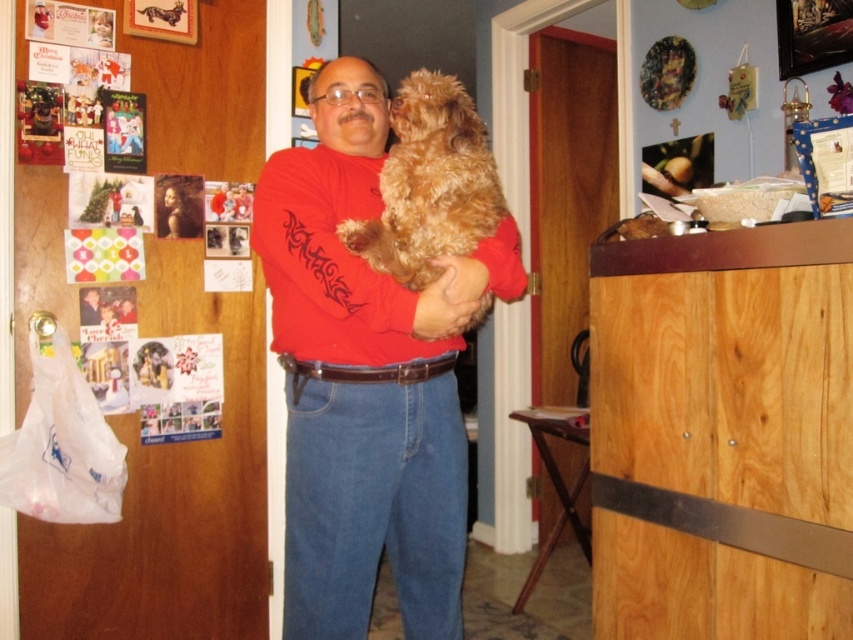
You are a delivery person who needs to deliver a package to the man in the image. The package can only be placed on the floor at point (366, 378). Will the package be visible to the man?

The package will be visible to the man because the point (366, 378) is where his matte red shirt is located, which is on his body, so placing the package there would actually be at his feet, within his line of sight.

You are a photographer trying to capture a clear photo of the matte red shirt at center and the fuzzy brown dog at center. Since you want both subjects to be in focus, you need to know which one is taller. Can you tell me which one is taller?

The matte red shirt at center is much taller than the fuzzy brown dog at center, so you should adjust your camera settings to focus on the taller object first.